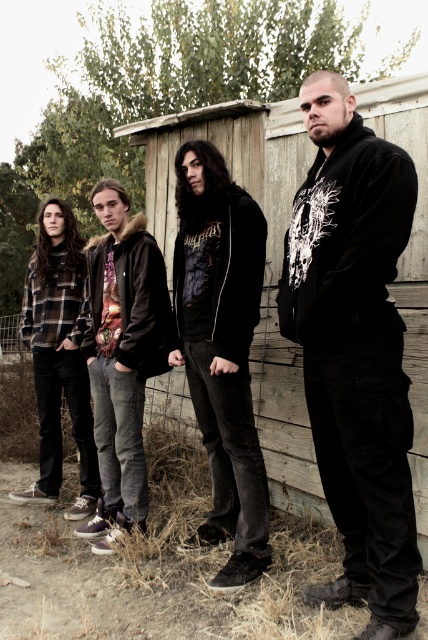
Question: Is black velvety hoodie at center further to camera compared to dark gray hoodie at center?

Choices:
 (A) no
 (B) yes

Answer: (A)

Question: Which point appears farthest from the camera in this image?

Choices:
 (A) tap(344, 115)
 (B) tap(196, 168)

Answer: (B)

Question: Does black velvety hoodie at center appear on the right side of dark gray hoodie at center?

Choices:
 (A) no
 (B) yes

Answer: (B)

Question: Among these objects, which one is nearest to the camera?

Choices:
 (A) black velvety hoodie at center
 (B) dark gray hoodie at center

Answer: (A)

Question: Among these objects, which one is nearest to the camera?

Choices:
 (A) black velvety hoodie at center
 (B) dark gray hoodie at center

Answer: (A)

Question: Does black velvety hoodie at center appear on the left side of dark gray hoodie at center?

Choices:
 (A) no
 (B) yes

Answer: (A)